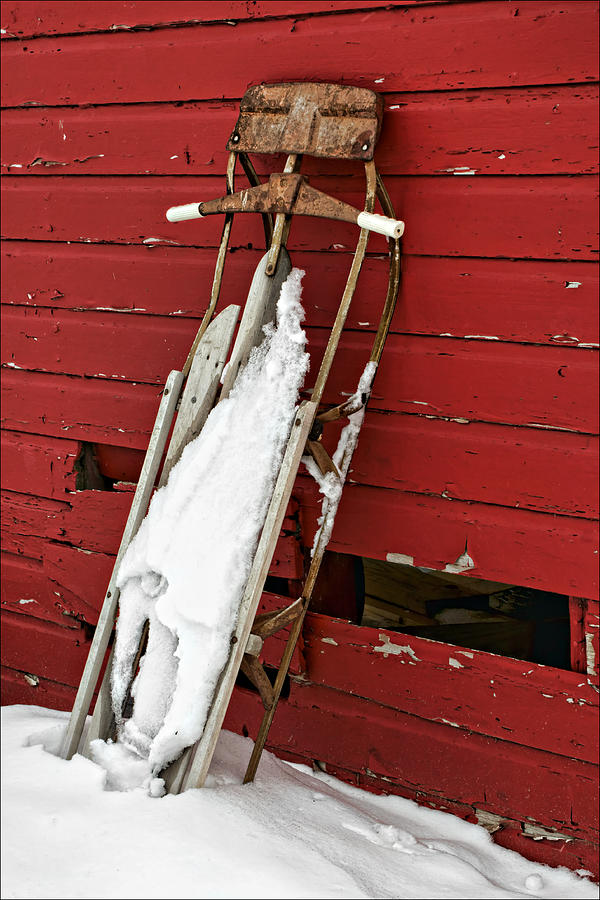
Image resolution: width=600 pixels, height=900 pixels. Identify the location of right handle. (386, 225).